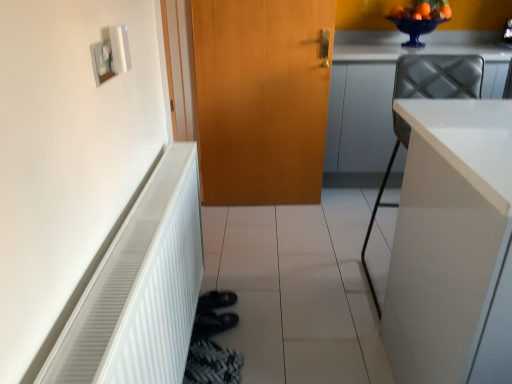
Describe the element at coordinates (388, 90) in the screenshot. The width and height of the screenshot is (512, 384). I see `white glossy cabinet at upper right, marked as the 1th cabinetry in a back-to-front arrangement` at that location.

In order to face white ribbed radiator at left, should I rotate leftwards or rightwards?

Turn left by 12.293 degrees to look at white ribbed radiator at left.

Where is `white plastic light switch at upper left`? The height and width of the screenshot is (384, 512). white plastic light switch at upper left is located at coordinates (111, 54).

What is the approximate width of white plastic light switch at upper left?

white plastic light switch at upper left is 0.55 inches in width.

Image resolution: width=512 pixels, height=384 pixels. Describe the element at coordinates (453, 246) in the screenshot. I see `white glossy cabinet at right, acting as the second cabinetry starting from the back` at that location.

You are a GUI agent. You are given a task and a screenshot of the screen. Output one action in this format:
    pyautogui.click(x=<x>, y=<y>)
    Task: Click on the white glossy cabinet at upper right, marked as the 1th cabinetry in a back-to-front arrangement
    The width and height of the screenshot is (512, 384).
    Given the screenshot: What is the action you would take?
    pyautogui.click(x=388, y=90)

Consider the image. Measure the distance from white glossy cabinet at upper right, placed as the second cabinetry when sorted from front to back, to white plastic light switch at upper left.

A distance of 6.50 feet exists between white glossy cabinet at upper right, placed as the second cabinetry when sorted from front to back, and white plastic light switch at upper left.

Is white glossy cabinet at upper right, placed as the second cabinetry when sorted from front to back, inside or outside of white plastic light switch at upper left?

white glossy cabinet at upper right, placed as the second cabinetry when sorted from front to back, is spatially situated outside white plastic light switch at upper left.

Between white glossy cabinet at upper right, placed as the second cabinetry when sorted from front to back, and white plastic light switch at upper left, which one has less height?

white plastic light switch at upper left.

From the image's perspective, which is below, white glossy cabinet at upper right, marked as the 1th cabinetry in a back-to-front arrangement, or white plastic light switch at upper left?

white plastic light switch at upper left is shown below in the image.

Locate an element on the screen. door above the white glossy cabinet at right, acting as the second cabinetry starting from the back (from the image's perspective) is located at coordinates (262, 98).

Is the surface of wooden door at center in direct contact with white glossy cabinet at right, positioned as the 1th cabinetry in front-to-back order?

There is a gap between wooden door at center and white glossy cabinet at right, positioned as the 1th cabinetry in front-to-back order.

Could white glossy cabinet at right, positioned as the 1th cabinetry in front-to-back order, be considered to be inside wooden door at center?

No, white glossy cabinet at right, positioned as the 1th cabinetry in front-to-back order, is not a part of wooden door at center.

In terms of height, does wooden door at center look taller or shorter compared to white glossy cabinet at right, positioned as the 1th cabinetry in front-to-back order?

Clearly, wooden door at center is taller compared to white glossy cabinet at right, positioned as the 1th cabinetry in front-to-back order.

From the image's perspective, does wooden door at center appear lower than white glossy cabinet at upper right, placed as the second cabinetry when sorted from front to back?

Yes.

Considering the relative positions of wooden door at center and white glossy cabinet at upper right, marked as the 1th cabinetry in a back-to-front arrangement, in the image provided, is wooden door at center to the right of white glossy cabinet at upper right, marked as the 1th cabinetry in a back-to-front arrangement, from the viewer's perspective?

In fact, wooden door at center is to the left of white glossy cabinet at upper right, marked as the 1th cabinetry in a back-to-front arrangement.

Which object is more forward, wooden door at center or white glossy cabinet at upper right, marked as the 1th cabinetry in a back-to-front arrangement?

wooden door at center.

Between wooden door at center and white glossy cabinet at upper right, placed as the second cabinetry when sorted from front to back, which one has smaller width?

With smaller width is wooden door at center.

Does white ribbed radiator at left have a greater height compared to white plastic light switch at upper left?

Indeed, white ribbed radiator at left has a greater height compared to white plastic light switch at upper left.

From a real-world perspective, which object stands above the other?

From a 3D spatial view, white plastic light switch at upper left is above.

Which of these two, white ribbed radiator at left or white plastic light switch at upper left, is smaller?

Smaller between the two is white plastic light switch at upper left.

Image resolution: width=512 pixels, height=384 pixels. I want to click on radiator below the white plastic light switch at upper left (from a real-world perspective), so click(x=141, y=288).

Which object is positioned more to the left, white glossy cabinet at right, positioned as the 1th cabinetry in front-to-back order, or white plastic light switch at upper left?

Positioned to the left is white plastic light switch at upper left.

Between white glossy cabinet at right, positioned as the 1th cabinetry in front-to-back order, and white plastic light switch at upper left, which one has less height?

Standing shorter between the two is white plastic light switch at upper left.

Which object is wider, white glossy cabinet at right, acting as the second cabinetry starting from the back, or white plastic light switch at upper left?

white glossy cabinet at right, acting as the second cabinetry starting from the back.

Is white plastic light switch at upper left in contact with white glossy cabinet at right, acting as the second cabinetry starting from the back?

No.

Is white plastic light switch at upper left inside or outside of white glossy cabinet at right, acting as the second cabinetry starting from the back?

white plastic light switch at upper left is not enclosed by white glossy cabinet at right, acting as the second cabinetry starting from the back.

Considering the sizes of objects white plastic light switch at upper left and white glossy cabinet at right, positioned as the 1th cabinetry in front-to-back order, in the image provided, who is shorter, white plastic light switch at upper left or white glossy cabinet at right, positioned as the 1th cabinetry in front-to-back order,?

Standing shorter between the two is white plastic light switch at upper left.

You are a GUI agent. You are given a task and a screenshot of the screen. Output one action in this format:
    pyautogui.click(x=<x>, y=<y>)
    Task: Click on the 2nd cabinetry counting from the right of the white ribbed radiator at left
    
    Given the screenshot: What is the action you would take?
    pyautogui.click(x=388, y=90)

How distant is white glossy cabinet at upper right, marked as the 1th cabinetry in a back-to-front arrangement, from white ribbed radiator at left?

The distance of white glossy cabinet at upper right, marked as the 1th cabinetry in a back-to-front arrangement, from white ribbed radiator at left is 1.64 meters.

Which is behind, point (334, 126) or point (175, 295)?

The point (334, 126) is farther.

Locate an element on the screen. the 2nd cabinetry to the right when counting from the white plastic light switch at upper left is located at coordinates (388, 90).

The image size is (512, 384). Find the location of `cabinetry below the wooden door at center (from the image's perspective)`. cabinetry below the wooden door at center (from the image's perspective) is located at coordinates click(453, 246).

Based on their spatial positions, is wooden door at center or white ribbed radiator at left further from white glossy cabinet at upper right, placed as the second cabinetry when sorted from front to back?

white ribbed radiator at left is further to white glossy cabinet at upper right, placed as the second cabinetry when sorted from front to back.

Which object lies nearer to the anchor point wooden door at center, white plastic light switch at upper left or white ribbed radiator at left?

white ribbed radiator at left.

In the scene shown: Which object lies nearer to the anchor point wooden door at center, white ribbed radiator at left or white glossy cabinet at upper right, marked as the 1th cabinetry in a back-to-front arrangement?

Based on the image, white glossy cabinet at upper right, marked as the 1th cabinetry in a back-to-front arrangement, appears to be nearer to wooden door at center.

From the image, which object appears to be nearer to white ribbed radiator at left, white glossy cabinet at right, acting as the second cabinetry starting from the back, or white glossy cabinet at upper right, placed as the second cabinetry when sorted from front to back?

white glossy cabinet at right, acting as the second cabinetry starting from the back, is closer to white ribbed radiator at left.

Estimate the real-world distances between objects in this image. Which object is further from white ribbed radiator at left, white plastic light switch at upper left or white glossy cabinet at upper right, placed as the second cabinetry when sorted from front to back?

white glossy cabinet at upper right, placed as the second cabinetry when sorted from front to back, lies further to white ribbed radiator at left than the other object.

When comparing their distances from white glossy cabinet at upper right, marked as the 1th cabinetry in a back-to-front arrangement, does white plastic light switch at upper left or white ribbed radiator at left seem further?

white plastic light switch at upper left is positioned further to the anchor white glossy cabinet at upper right, marked as the 1th cabinetry in a back-to-front arrangement.

When comparing their distances from white glossy cabinet at right, positioned as the 1th cabinetry in front-to-back order, does white glossy cabinet at upper right, marked as the 1th cabinetry in a back-to-front arrangement, or white ribbed radiator at left seem closer?

Result: Among the two, white ribbed radiator at left is located nearer to white glossy cabinet at right, positioned as the 1th cabinetry in front-to-back order.

Looking at this image, based on their spatial positions, is white ribbed radiator at left or wooden door at center closer to white plastic light switch at upper left?

white ribbed radiator at left is closer to white plastic light switch at upper left.

Where is `door between white glossy cabinet at right, acting as the second cabinetry starting from the back, and white glossy cabinet at upper right, placed as the second cabinetry when sorted from front to back, along the z-axis`? Image resolution: width=512 pixels, height=384 pixels. door between white glossy cabinet at right, acting as the second cabinetry starting from the back, and white glossy cabinet at upper right, placed as the second cabinetry when sorted from front to back, along the z-axis is located at coordinates pyautogui.click(x=262, y=98).

Find the location of a particular element. This screenshot has width=512, height=384. light switch between white ribbed radiator at left and white glossy cabinet at upper right, marked as the 1th cabinetry in a back-to-front arrangement, in the front-back direction is located at coordinates (111, 54).

Locate an element on the screen. This screenshot has height=384, width=512. radiator located between white plastic light switch at upper left and white glossy cabinet at right, positioned as the 1th cabinetry in front-to-back order, in the left-right direction is located at coordinates (141, 288).

The height and width of the screenshot is (384, 512). Identify the location of light switch between white glossy cabinet at right, acting as the second cabinetry starting from the back, and wooden door at center, along the z-axis. coord(111,54).